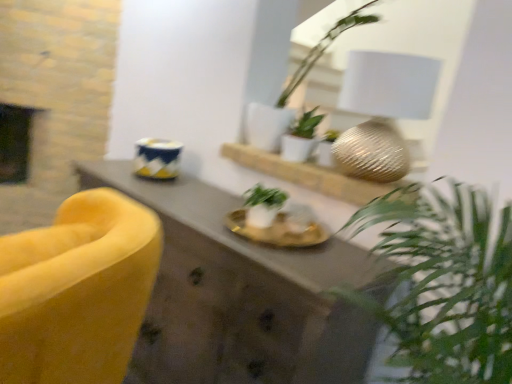
Question: In the image, is metallic gold sphere at center on the left side or the right side of velvet yellow armchair at left?

Choices:
 (A) right
 (B) left

Answer: (A)

Question: Is metallic gold sphere at center inside the boundaries of velvet yellow armchair at left, or outside?

Choices:
 (A) outside
 (B) inside

Answer: (A)

Question: Based on their relative distances, which object is nearer to the metallic gold sphere at center?

Choices:
 (A) green matte plant at center, marked as the third houseplant in a top-to-bottom arrangement
 (B) velvet yellow armchair at left
 (C) black matte fireplace at left
 (D) white matte plant at center, the 2th houseplant from the bottom
 (E) white ceramic plant at upper center, which is the 1th houseplant from top to bottom

Answer: (D)

Question: Estimate the real-world distances between objects in this image. Which object is farther from the velvet yellow armchair at left?

Choices:
 (A) green matte plant at center, arranged as the 1th houseplant when ordered from the bottom
 (B) white matte plant at center, the 2th houseplant from the bottom
 (C) white ceramic plant at upper center, which is the 1th houseplant from top to bottom
 (D) metallic gold sphere at center
 (E) black matte fireplace at left

Answer: (E)